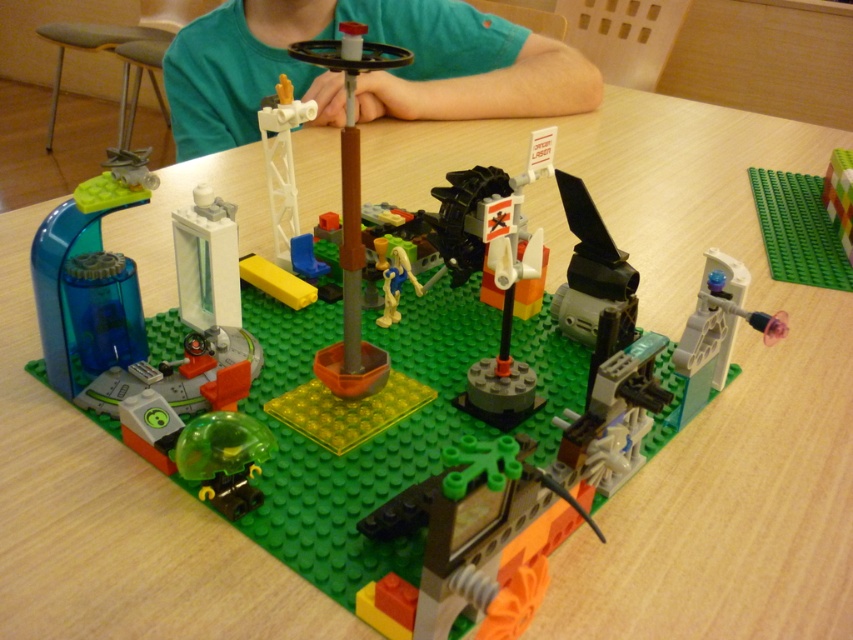
You are a delivery robot that needs to place a package between the green matte shirt at upper center and the yellow matte figure at center. The package requires a minimum of 30 inches of space. Can you fit the package between them?

The distance between the green matte shirt at upper center and the yellow matte figure at center is 31.23 inches, which is more than the required 30 inches. Therefore, the package can be placed between them.

What are the coordinates of the green matte shirt at upper center in the LEGO construction set?

The green matte shirt at upper center is located at coordinates point [366,74].

Which object is wider between the green matte shirt at upper center and the yellow matte figure at center?

The green matte shirt at upper center is wider than the yellow matte figure at center according to the description.